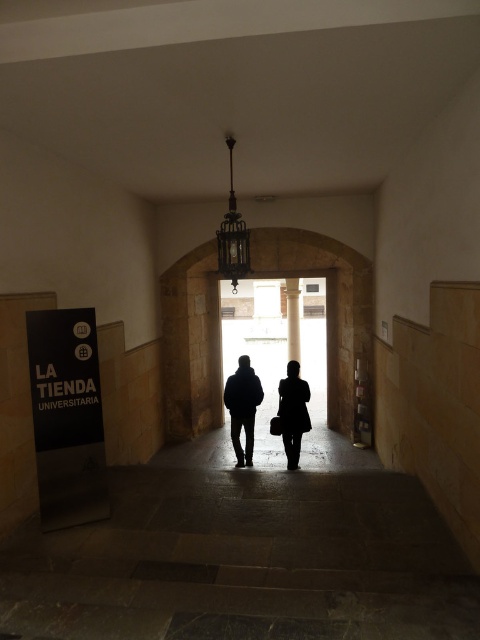
Is black matte couple at center wider than dark blue jacket at center?

Indeed, black matte couple at center has a greater width compared to dark blue jacket at center.

Does point (288, 458) lie behind point (233, 394)?

No, it is not.

Identify the location of black matte couple at center. The height and width of the screenshot is (640, 480). (242, 406).

This screenshot has height=640, width=480. I want to click on black matte couple at center, so click(242, 406).

Find the location of a particular element. black matte couple at center is located at coordinates click(x=242, y=406).

Does point (296, 376) come farther from viewer compared to point (295, 358)?

No.

Is silhouette coat at center wider than smooth stone pillar at center?

Yes, silhouette coat at center is wider than smooth stone pillar at center.

Measure the distance between silhouette coat at center and camera.

silhouette coat at center and camera are 21.93 feet apart from each other.

You are a GUI agent. You are given a task and a screenshot of the screen. Output one action in this format:
    pyautogui.click(x=<x>, y=<y>)
    Task: Click on the silhouette coat at center
    The height and width of the screenshot is (640, 480).
    Given the screenshot: What is the action you would take?
    pyautogui.click(x=292, y=412)